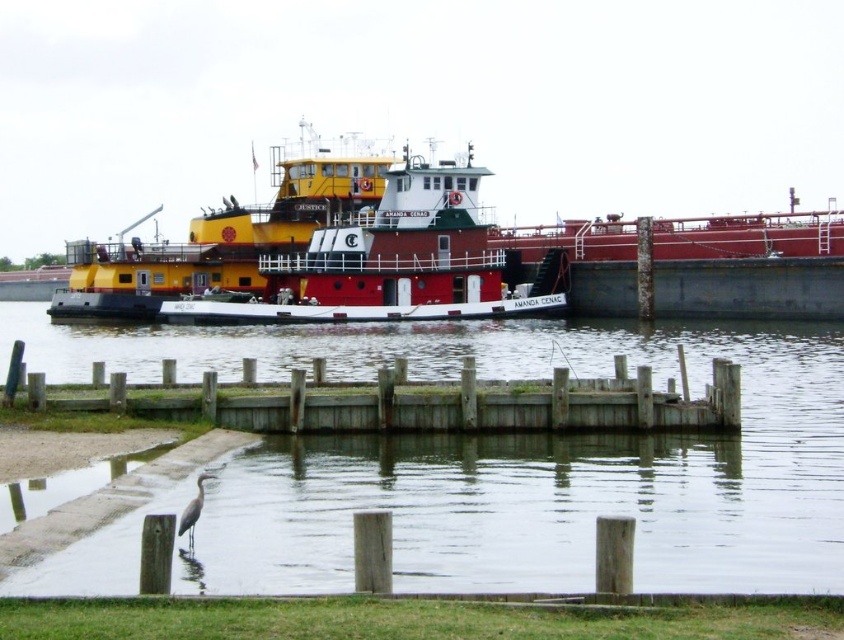
You are a delivery person trying to unload heavy crates onto the smooth concrete dock at lower center and the red matte tugboat at center. Which surface can accommodate more crates based on their size?

The smooth concrete dock at lower center is bigger than the red matte tugboat at center, so it can accommodate more crates.

You are a crane operator on the weathered wood dock at lower center trying to lift a heavy container. The yellow matte tugboat at upper center is nearby. Can you safely lift the container without hitting the tugboat?

The weathered wood dock at lower center is not as tall as the yellow matte tugboat at upper center, so lifting the container might risk collision. Check the height clearance before proceeding.